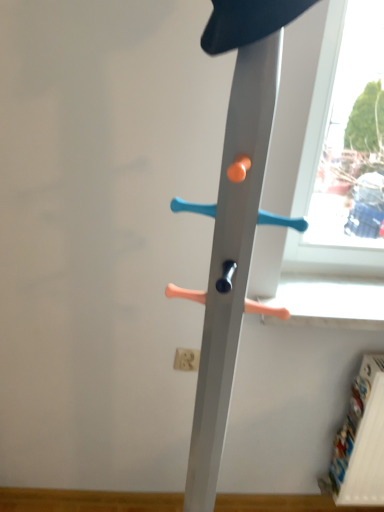
Consider the image. Measure the distance between metal coat rack at center and camera.

metal coat rack at center is 22.16 inches from camera.

What is the approximate height of metal coat rack at center?

1.49 meters.

The image size is (384, 512). Describe the element at coordinates (234, 219) in the screenshot. I see `metal coat rack at center` at that location.

Locate an element on the screen. Image resolution: width=384 pixels, height=512 pixels. metal coat rack at center is located at coordinates (234, 219).

Locate an element on the screen. This screenshot has height=512, width=384. white matte electric outlet at lower center is located at coordinates (186, 359).

This screenshot has width=384, height=512. What do you see at coordinates (186, 359) in the screenshot? I see `white matte electric outlet at lower center` at bounding box center [186, 359].

Identify the location of metal coat rack at center. The height and width of the screenshot is (512, 384). (234, 219).

Is metal coat rack at center to the left of white matte electric outlet at lower center from the viewer's perspective?

No.

Which is behind, metal coat rack at center or white matte electric outlet at lower center?

white matte electric outlet at lower center.

Does point (197, 429) lie in front of point (176, 351)?

Yes, it is.

From the image's perspective, is metal coat rack at center above or below white matte electric outlet at lower center?

metal coat rack at center is situated higher than white matte electric outlet at lower center in the image.

From a real-world perspective, is metal coat rack at center physically above white matte electric outlet at lower center?

Correct, in the physical world, metal coat rack at center is higher than white matte electric outlet at lower center.

Considering the sizes of objects metal coat rack at center and white matte electric outlet at lower center in the image provided, who is wider, metal coat rack at center or white matte electric outlet at lower center?

metal coat rack at center.

Who is shorter, metal coat rack at center or white matte electric outlet at lower center?

white matte electric outlet at lower center.

Between metal coat rack at center and white matte electric outlet at lower center, which one has smaller size?

With smaller size is white matte electric outlet at lower center.

Consider the image. Is metal coat rack at center completely or partially outside of white matte electric outlet at lower center?

Yes, metal coat rack at center is located beyond the bounds of white matte electric outlet at lower center.

Is metal coat rack at center far from white matte electric outlet at lower center?

No, metal coat rack at center is not far from white matte electric outlet at lower center.

Does metal coat rack at center turn towards white matte electric outlet at lower center?

Yes, metal coat rack at center is aimed at white matte electric outlet at lower center.

Locate an element on the screen. This screenshot has height=512, width=384. furniture on the right of white matte electric outlet at lower center is located at coordinates (234, 219).

Considering the positions of objects white matte electric outlet at lower center and metal coat rack at center in the image provided, who is more to the left, white matte electric outlet at lower center or metal coat rack at center?

white matte electric outlet at lower center.

Which is in front, white matte electric outlet at lower center or metal coat rack at center?

metal coat rack at center is closer to the camera.

Is point (175, 361) positioned after point (263, 102)?

Yes, it is.

From the image's perspective, is white matte electric outlet at lower center located beneath metal coat rack at center?

Indeed, from the image's perspective, white matte electric outlet at lower center is shown beneath metal coat rack at center.

From a real-world perspective, which is physically below, white matte electric outlet at lower center or metal coat rack at center?

white matte electric outlet at lower center.

Looking at this image, considering the sizes of objects white matte electric outlet at lower center and metal coat rack at center in the image provided, who is wider, white matte electric outlet at lower center or metal coat rack at center?

metal coat rack at center.

Is white matte electric outlet at lower center taller than metal coat rack at center?

In fact, white matte electric outlet at lower center may be shorter than metal coat rack at center.

Who is smaller, white matte electric outlet at lower center or metal coat rack at center?

white matte electric outlet at lower center.

From the picture: Could metal coat rack at center be considered to be inside white matte electric outlet at lower center?

No, metal coat rack at center is not a part of white matte electric outlet at lower center.

Is white matte electric outlet at lower center not close to metal coat rack at center?

No, white matte electric outlet at lower center is in close proximity to metal coat rack at center.

Could you tell me if white matte electric outlet at lower center is turned towards metal coat rack at center?

Yes, white matte electric outlet at lower center is facing metal coat rack at center.

You are a GUI agent. You are given a task and a screenshot of the screen. Output one action in this format:
    pyautogui.click(x=<x>, y=<y>)
    Task: Click on the furniture in front of the white matte electric outlet at lower center
    The height and width of the screenshot is (512, 384).
    Given the screenshot: What is the action you would take?
    pyautogui.click(x=234, y=219)

At what (x,y) coordinates should I click in order to perform the action: click on electric outlet that appears behind the metal coat rack at center. Please return your answer as a coordinate pair (x, y). The width and height of the screenshot is (384, 512). Looking at the image, I should click on (186, 359).

Find the location of a particular element. The height and width of the screenshot is (512, 384). furniture above the white matte electric outlet at lower center (from the image's perspective) is located at coordinates [x=234, y=219].